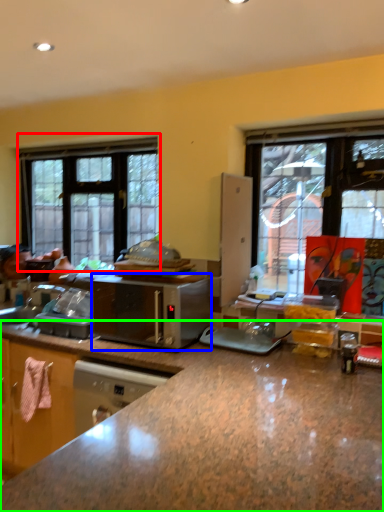
Question: Estimate the real-world distances between objects in this image. Which object is farther from window (highlighted by a red box), microwave oven (highlighted by a blue box) or countertop (highlighted by a green box)?

Choices:
 (A) microwave oven
 (B) countertop

Answer: (B)